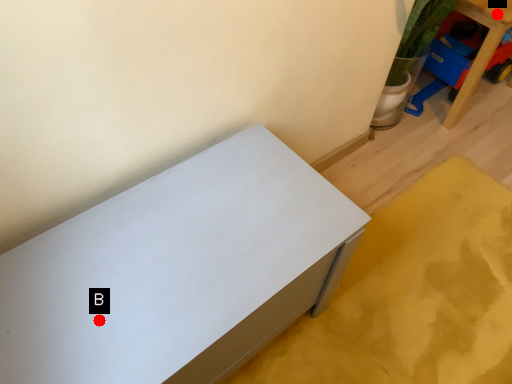
Question: Two points are circled on the image, labeled by A and B beside each circle. Among these points, which one is nearest to the camera?

Choices:
 (A) A is closer
 (B) B is closer

Answer: (B)